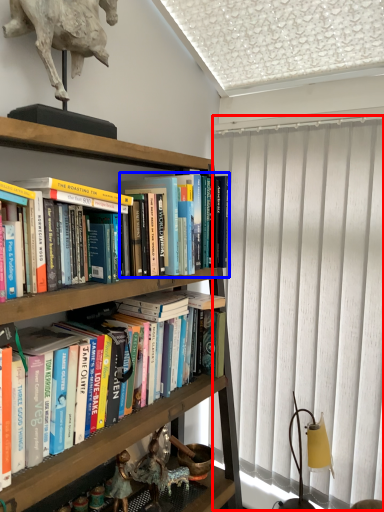
Question: Which object appears farthest to the camera in this image, curtain (highlighted by a red box) or book (highlighted by a blue box)?

Choices:
 (A) curtain
 (B) book

Answer: (A)